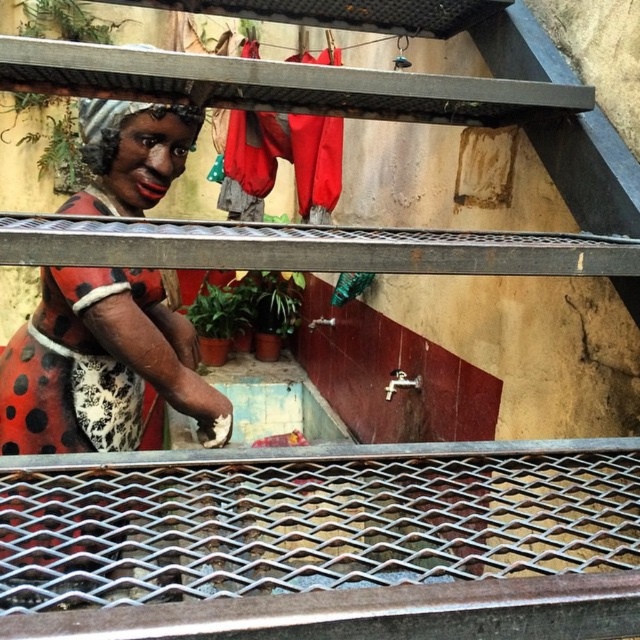
In order to click on polka dot fabric at center in this screenshot , I will do `click(102, 364)`.

In the scene shown: Who is more forward, (77, 323) or (262, 147)?

Positioned in front is point (77, 323).

Is point (99, 404) positioned behind point (260, 147)?

That is False.

Where is `polka dot fabric at center`? The width and height of the screenshot is (640, 640). polka dot fabric at center is located at coordinates (102, 364).

Between point (120, 189) and point (394, 273), which one is positioned behind?

Positioned behind is point (120, 189).

Is polka dot fabric at center bigger than metallic grid at center?

Indeed, polka dot fabric at center has a larger size compared to metallic grid at center.

Is point (205, 412) less distant than point (493, 268)?

No, (205, 412) is further to viewer.

This screenshot has width=640, height=640. Identify the location of polka dot fabric at center. (102, 364).

Which is behind, point (392, 268) or point (296, 115)?

Positioned behind is point (296, 115).

In the scene shown: Does metallic grid at center have a larger size compared to red fabric laundry at upper center?

No, metallic grid at center is not bigger than red fabric laundry at upper center.

Between point (134, 253) and point (330, 58), which one is positioned in front?

Positioned in front is point (134, 253).

The height and width of the screenshot is (640, 640). What are the coordinates of `metallic grid at center` in the screenshot? It's located at (307, 248).